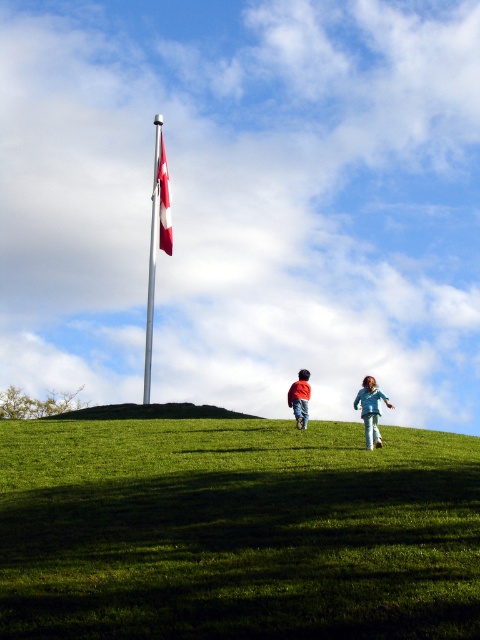
Who is shorter, light blue denim pants at lower right or red fleece jacket at center?

Standing shorter between the two is red fleece jacket at center.

Can you confirm if light blue denim pants at lower right is positioned to the left of red fleece jacket at center?

No, light blue denim pants at lower right is not to the left of red fleece jacket at center.

What do you see at coordinates (371, 410) in the screenshot? I see `light blue denim pants at lower right` at bounding box center [371, 410].

Identify the location of light blue denim pants at lower right. This screenshot has height=640, width=480. (371, 410).

Who is positioned more to the right, polished metal flag pole at center or red fleece jacket at center?

red fleece jacket at center

Is point (155, 202) farther from camera compared to point (300, 417)?

Yes.

Locate an element on the screen. polished metal flag pole at center is located at coordinates (153, 256).

Is green grassy hillside at center below polished metal flag pole at center?

Correct, green grassy hillside at center is located below polished metal flag pole at center.

Is point (158, 404) positioned after point (152, 268)?

No, (158, 404) is in front of (152, 268).

This screenshot has height=640, width=480. I want to click on green grassy hillside at center, so click(152, 412).